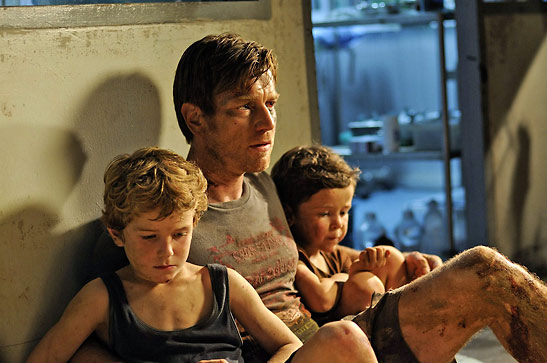
Identify the location of lit-up other room. Image resolution: width=547 pixels, height=363 pixels. (399, 158).